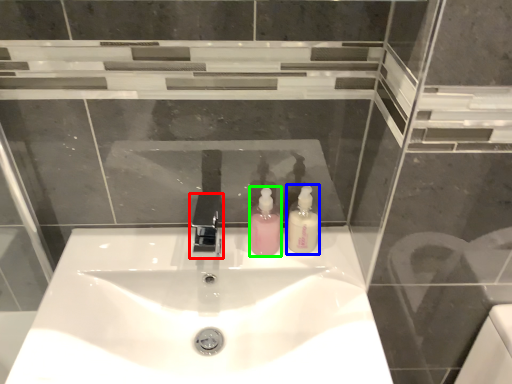
Question: Based on their relative distances, which object is farther from tap (highlighted by a red box)? Choose from soap dispenser (highlighted by a blue box) and soap dispenser (highlighted by a green box).

Choices:
 (A) soap dispenser
 (B) soap dispenser

Answer: (A)